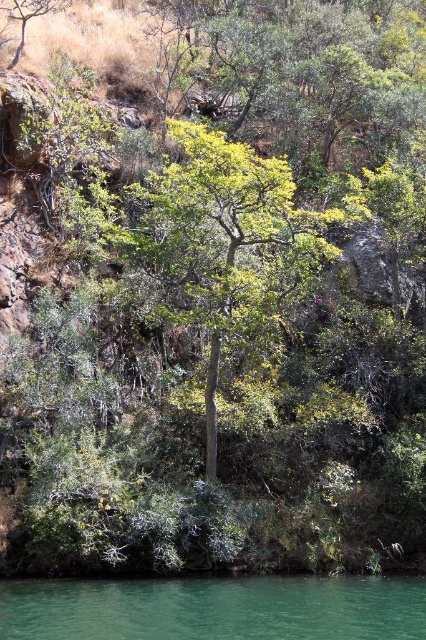
Is the position of green leafy tree at center less distant than that of green translucent water at lower center?

That is False.

Which is above, green leafy tree at center or green translucent water at lower center?

green leafy tree at center is above.

This screenshot has width=426, height=640. Describe the element at coordinates (224, 241) in the screenshot. I see `green leafy tree at center` at that location.

At what (x,y) coordinates should I click in order to perform the action: click on green leafy tree at center. Please return your answer as a coordinate pair (x, y). Looking at the image, I should click on (224, 241).